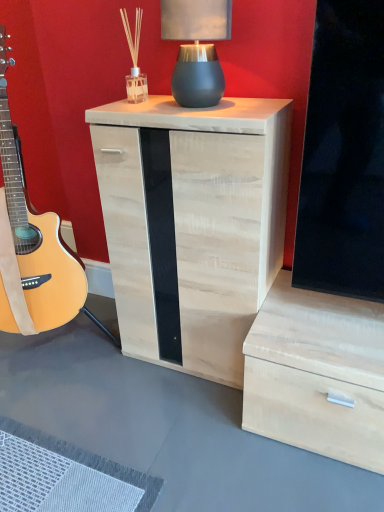
You are a GUI agent. You are given a task and a screenshot of the screen. Output one action in this format:
    pyautogui.click(x=<x>, y=<y>)
    Task: Click on the free location to the right of matte gray ceramic table lamp at upper center
    
    Given the screenshot: What is the action you would take?
    point(258,99)